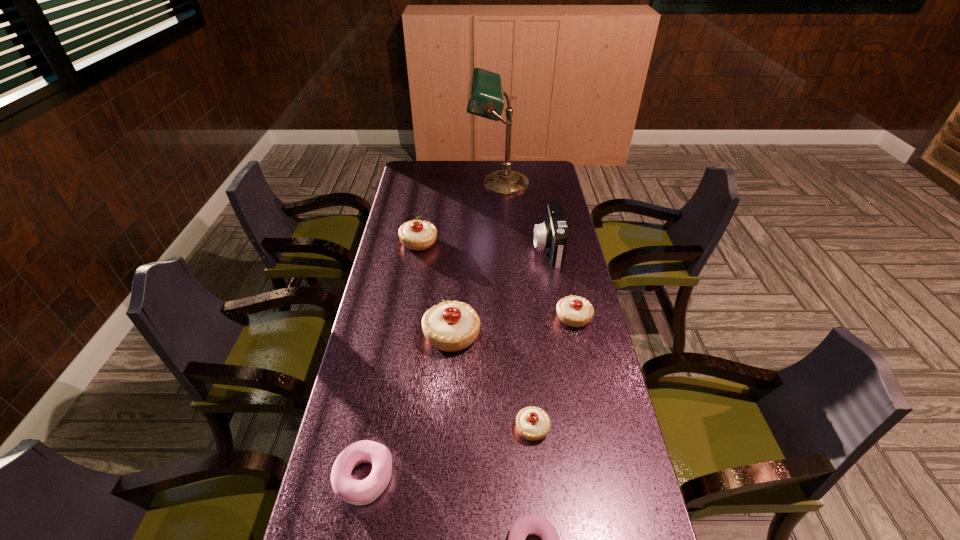
Identify the location of the bigger pink pastry. (357, 492).

At what (x,y) coordinates should I click in order to perform the action: click on the second shortest pastry. Please return your answer as a coordinate pair (x, y). Looking at the image, I should click on (357, 492).

Find the location of a particular element. The width and height of the screenshot is (960, 540). vacant space situated above the green lampshade of the tallest object is located at coordinates (417, 183).

This screenshot has width=960, height=540. Find the location of `blank space located 0.070m above the green lampshade of the tallest object`. blank space located 0.070m above the green lampshade of the tallest object is located at coordinates (454, 183).

The height and width of the screenshot is (540, 960). Identify the location of free space located above the green lampshade of the tallest object. (450, 183).

Where is `free space located on the lens of the camcorder`? free space located on the lens of the camcorder is located at coordinates (496, 248).

Identify the location of vacant space located on the lens of the camcorder. This screenshot has height=540, width=960. (461, 248).

Find the location of a particular element. This screenshot has height=540, width=960. free space located 0.330m on the lens of the camcorder is located at coordinates (450, 248).

I want to click on vacant area located on the left of the biggest beige pastry, so click(x=398, y=335).

Identify the location of free location located on the back of the third smallest beige pastry. (425, 205).